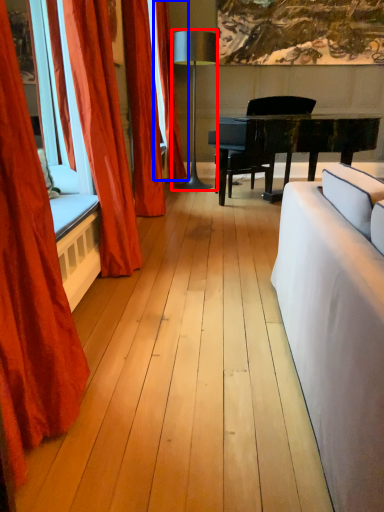
Question: Which object is further to the camera taking this photo, lamp (highlighted by a red box) or curtain (highlighted by a blue box)?

Choices:
 (A) lamp
 (B) curtain

Answer: (B)